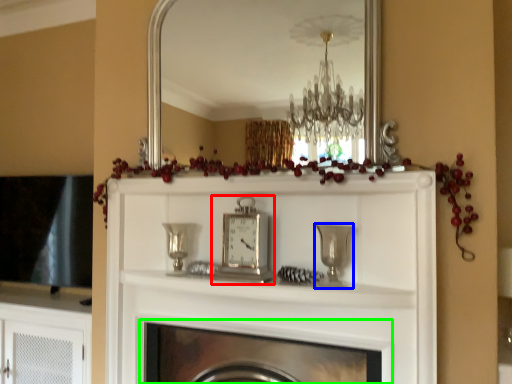
Question: Which object is the farthest from clock (highlighted by a red box)? Choose among these: candle holder (highlighted by a blue box) or fireplace (highlighted by a green box).

Choices:
 (A) candle holder
 (B) fireplace

Answer: (B)